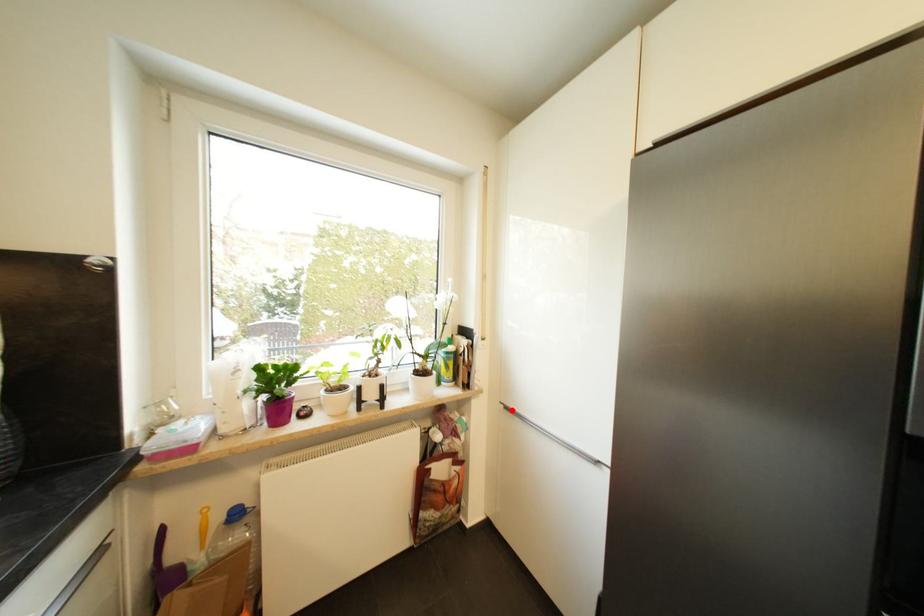
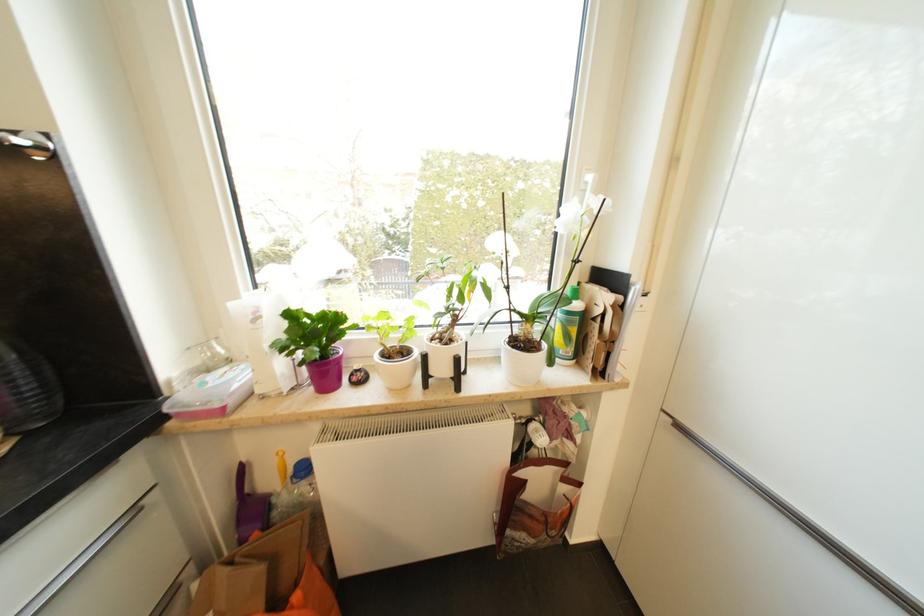
Find the pixel in the second image that matches the highlighted location in the first image.

(685, 429)